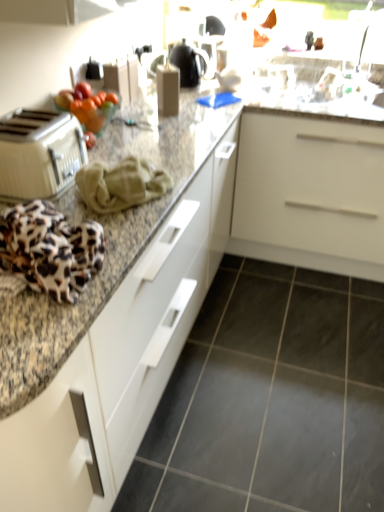
Describe the element at coordinates (50, 250) in the screenshot. I see `leopard print fabric at left` at that location.

Where is `shiny glass bowl of fruits at upper left`? The image size is (384, 512). shiny glass bowl of fruits at upper left is located at coordinates (89, 106).

You are a GUI agent. You are given a task and a screenshot of the screen. Output one action in this format:
    pyautogui.click(x=<x>, y=<y>)
    Task: Click on the granite countertop at center
    The image size is (384, 512).
    Given the screenshot: What is the action you would take?
    pyautogui.click(x=106, y=253)

Image resolution: width=384 pixels, height=512 pixels. I want to click on beige plastic toaster at left, so click(39, 153).

In order to face beige plastic toaster at left, should I rotate leftwards or rightwards?

Rotate left and turn 19.813 degrees.

Locate an element on the screen. This screenshot has height=512, width=384. leopard print fabric at left is located at coordinates (50, 250).

Would you say leopard print fabric at left is outside white matte cabinet at center?

Actually, leopard print fabric at left is within white matte cabinet at center.

Which object is positioned more to the left, leopard print fabric at left or white matte cabinet at center?

From the viewer's perspective, leopard print fabric at left appears more on the left side.

Does leopard print fabric at left have a lesser width compared to white matte cabinet at center?

Correct, the width of leopard print fabric at left is less than that of white matte cabinet at center.

From a real-world perspective, is leopard print fabric at left over white matte cabinet at center?

Yes, from a real-world perspective, leopard print fabric at left is on top of white matte cabinet at center.

Is metallic silver faucet at upper right facing away from shiny glass bowl of fruits at upper left?

No, metallic silver faucet at upper right is not facing away from shiny glass bowl of fruits at upper left.

Can you see metallic silver faucet at upper right touching shiny glass bowl of fruits at upper left?

metallic silver faucet at upper right and shiny glass bowl of fruits at upper left are clearly separated.

Identify the location of fruit below the metallic silver faucet at upper right (from the image's perspective). (89, 106).

Is metallic silver faucet at upper right positioned in front of shiny glass bowl of fruits at upper left?

No, metallic silver faucet at upper right is further to the viewer.

The height and width of the screenshot is (512, 384). In the image, there is a metallic silver faucet at upper right. Find the location of `granite below it (from a real-world perspective)`. granite below it (from a real-world perspective) is located at coordinates (271, 399).

Considering the sizes of objects metallic silver faucet at upper right and gray tile floor at lower center in the image provided, who is smaller, metallic silver faucet at upper right or gray tile floor at lower center?

With smaller size is metallic silver faucet at upper right.

Which object is wider, metallic silver faucet at upper right or gray tile floor at lower center?

Wider between the two is gray tile floor at lower center.

Considering the sizes of metallic silver faucet at upper right and gray tile floor at lower center in the image, is metallic silver faucet at upper right taller or shorter than gray tile floor at lower center?

In the image, metallic silver faucet at upper right appears to be taller than gray tile floor at lower center.

Is white matte cabinet at center facing away from leopard print fabric at left?

No, white matte cabinet at center's orientation is not away from leopard print fabric at left.

Between white matte cabinet at center and leopard print fabric at left, which one has smaller size?

Smaller between the two is leopard print fabric at left.

Between white matte cabinet at center and leopard print fabric at left, which one appears on the right side from the viewer's perspective?

white matte cabinet at center is more to the right.

Can you confirm if white matte cabinet at center is thinner than leopard print fabric at left?

No, white matte cabinet at center is not thinner than leopard print fabric at left.

From the image's perspective, between gray tile floor at lower center and leopard print fabric at left, who is located below?

gray tile floor at lower center is shown below in the image.

From a real-world perspective, between gray tile floor at lower center and leopard print fabric at left, who is vertically lower?

In real-world perspective, gray tile floor at lower center is lower.

You are a GUI agent. You are given a task and a screenshot of the screen. Output one action in this format:
    pyautogui.click(x=<x>, y=<y>)
    Task: Click on the granite that is below the leopard print fabric at left (from the image's perspective)
    
    Given the screenshot: What is the action you would take?
    pyautogui.click(x=271, y=399)

Considering the sizes of objects gray tile floor at lower center and leopard print fabric at left in the image provided, who is thinner, gray tile floor at lower center or leopard print fabric at left?

Thinner between the two is leopard print fabric at left.

You are a GUI agent. You are given a task and a screenshot of the screen. Output one action in this format:
    pyautogui.click(x=<x>, y=<y>)
    Task: Click on the fruit located behind the white matte cabinet at center
    This screenshot has height=512, width=384.
    Given the screenshot: What is the action you would take?
    pyautogui.click(x=89, y=106)

Is shiny glass bowl of fruits at upper left oriented away from white matte cabinet at center?

That's right, shiny glass bowl of fruits at upper left is facing away from white matte cabinet at center.

From a real-world perspective, which is physically below, shiny glass bowl of fruits at upper left or white matte cabinet at center?

From a 3D spatial view, white matte cabinet at center is below.

Which object is closer to the camera taking this photo, shiny glass bowl of fruits at upper left or white matte cabinet at center?

Positioned in front is white matte cabinet at center.

Which object is thinner, beige plastic toaster at left or metallic silver faucet at upper right?

With smaller width is metallic silver faucet at upper right.

Find the location of a particular element. faucet beneath the beige plastic toaster at left (from a real-world perspective) is located at coordinates (329, 85).

Is beige plastic toaster at left oriented towards metallic silver faucet at upper right?

No, beige plastic toaster at left is not oriented towards metallic silver faucet at upper right.

From the image's perspective, which one is positioned lower, beige plastic toaster at left or metallic silver faucet at upper right?

beige plastic toaster at left is shown below in the image.

At what (x,y) coordinates should I click in order to perform the action: click on cabinetry lying below the leopard print fabric at left (from the image's perspective). Please return your answer as a coordinate pair (x, y). This screenshot has height=512, width=384. Looking at the image, I should click on (121, 359).

Image resolution: width=384 pixels, height=512 pixels. Find the location of `fruit that is in front of the metallic silver faucet at upper right`. fruit that is in front of the metallic silver faucet at upper right is located at coordinates (89, 106).

From the picture: Which object lies nearer to the anchor point granite countertop at center, white matte cabinet at center or leopard print fabric at left?

leopard print fabric at left is closer to granite countertop at center.

Based on their spatial positions, is granite countertop at center or metallic silver faucet at upper right further from shiny glass bowl of fruits at upper left?

metallic silver faucet at upper right is further to shiny glass bowl of fruits at upper left.

From the image, which object appears to be nearer to shiny glass bowl of fruits at upper left, gray tile floor at lower center or white matte cabinet at center?

Based on the image, white matte cabinet at center appears to be nearer to shiny glass bowl of fruits at upper left.

Based on the photo, which object lies further to the anchor point beige plastic toaster at left, metallic silver faucet at upper right or white matte cabinet at center?

metallic silver faucet at upper right is positioned further to the anchor beige plastic toaster at left.

Which object lies nearer to the anchor point metallic silver faucet at upper right, shiny glass bowl of fruits at upper left or beige plastic toaster at left?

shiny glass bowl of fruits at upper left lies closer to metallic silver faucet at upper right than the other object.

Looking at the image, which one is located further to metallic silver faucet at upper right, leopard print fabric at left or gray tile floor at lower center?

Based on the image, leopard print fabric at left appears to be further to metallic silver faucet at upper right.

Based on their spatial positions, is white matte cabinet at center or granite countertop at center closer to beige plastic toaster at left?

granite countertop at center lies closer to beige plastic toaster at left than the other object.

Considering their positions, is shiny glass bowl of fruits at upper left positioned further to leopard print fabric at left than beige plastic toaster at left?

The object further to leopard print fabric at left is shiny glass bowl of fruits at upper left.

I want to click on blanket between granite countertop at center and metallic silver faucet at upper right along the z-axis, so click(x=50, y=250).

This screenshot has height=512, width=384. I want to click on toaster positioned between granite countertop at center and metallic silver faucet at upper right from near to far, so click(39, 153).

This screenshot has width=384, height=512. I want to click on toaster located between white matte cabinet at center and metallic silver faucet at upper right in the depth direction, so click(39, 153).

Identify the location of fruit located between white matte cabinet at center and metallic silver faucet at upper right in the depth direction. Image resolution: width=384 pixels, height=512 pixels. (89, 106).